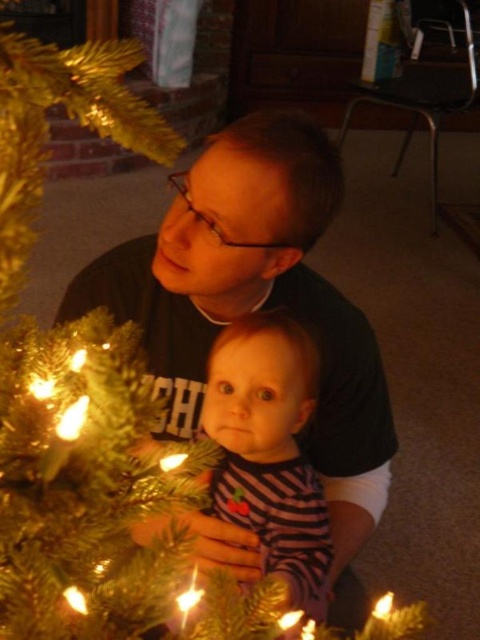
Is point (249, 554) in front of point (178, 632)?

That is False.

From the picture: Is matte black shirt at center shorter than shiny gold candle at lower center?

Incorrect, matte black shirt at center's height does not fall short of shiny gold candle at lower center's.

Between point (289, 296) and point (201, 592), which one is positioned behind?

Positioned behind is point (289, 296).

This screenshot has width=480, height=640. Find the location of `matte black shirt at center`. matte black shirt at center is located at coordinates (259, 308).

Does matte black shirt at center have a smaller size compared to translucent glass candle at lower center?

No, matte black shirt at center is not smaller than translucent glass candle at lower center.

From the picture: Who is higher up, matte black shirt at center or translucent glass candle at lower center?

matte black shirt at center is above.

You are a GUI agent. You are given a task and a screenshot of the screen. Output one action in this format:
    pyautogui.click(x=<x>, y=<y>)
    Task: Click on the matte black shirt at center
    The height and width of the screenshot is (640, 480).
    Given the screenshot: What is the action you would take?
    pyautogui.click(x=259, y=308)

Who is more distant from viewer, (372, 413) or (380, 616)?

Point (372, 413)

This screenshot has height=640, width=480. Describe the element at coordinates (259, 308) in the screenshot. I see `matte black shirt at center` at that location.

Find the location of a particular element. This screenshot has width=480, height=640. matte black shirt at center is located at coordinates (259, 308).